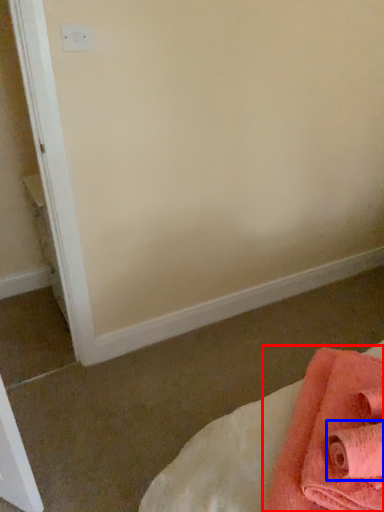
Question: Which point is closer to the camera, towel (highlighted by a red box) or bath towel (highlighted by a blue box)?

Choices:
 (A) towel
 (B) bath towel

Answer: (A)